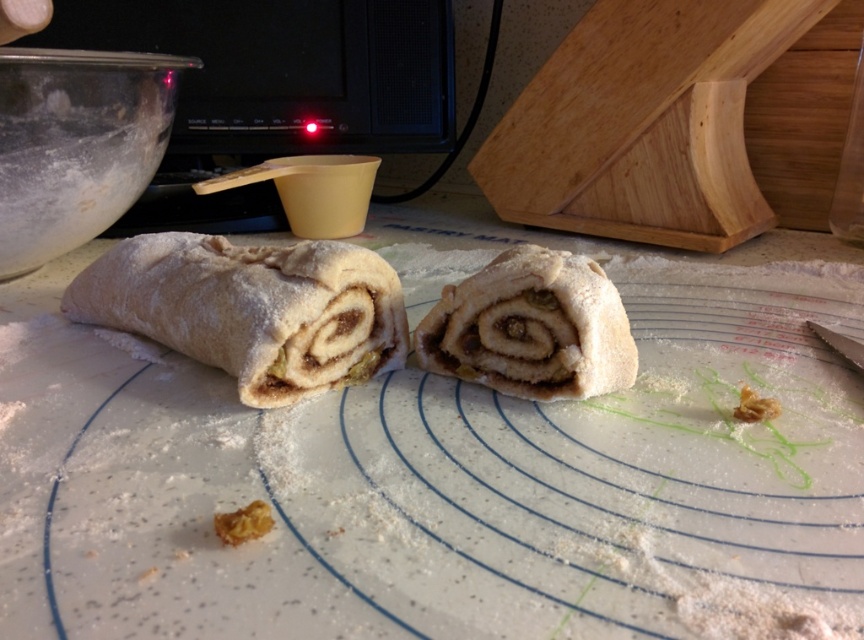
Question: Does powdered white dough at center have a larger size compared to yellow crumbly pastry at center?

Choices:
 (A) no
 (B) yes

Answer: (B)

Question: Where is cinnamon-sugar pastry at center located in relation to yellow crumbly pastry at center in the image?

Choices:
 (A) below
 (B) above

Answer: (B)

Question: Which point appears closest to the camera in this image?

Choices:
 (A) (239, 525)
 (B) (380, 339)
 (C) (98, 474)
 (D) (602, 312)

Answer: (A)

Question: Which object is farther from the camera taking this photo?

Choices:
 (A) powdered white dough at center
 (B) powdery white dough at center

Answer: (B)

Question: Estimate the real-world distances between objects in this image. Which object is farther from the powdered white dough at center?

Choices:
 (A) powdery white dough at center
 (B) yellow crumbly pastry at center

Answer: (B)

Question: Is cinnamon-sugar pastry at center thinner than yellow crumbly pastry at center?

Choices:
 (A) yes
 (B) no

Answer: (B)